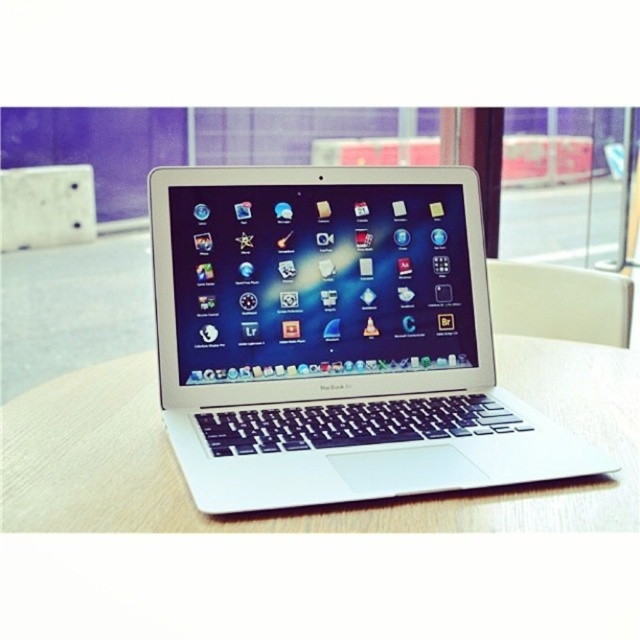
You are sitting in a room and want to move your chair to the left side of the wooden table at center. Can you do that without moving the white plastic chair at right?

The wooden table at center is positioned on the left side of white plastic chair at right, so the white plastic chair at right is currently to the right of the wooden table at center. To move the white plastic chair at right to the left side of the wooden table at center, you would need to shift it to the left, which would require moving the white plastic chair at right.